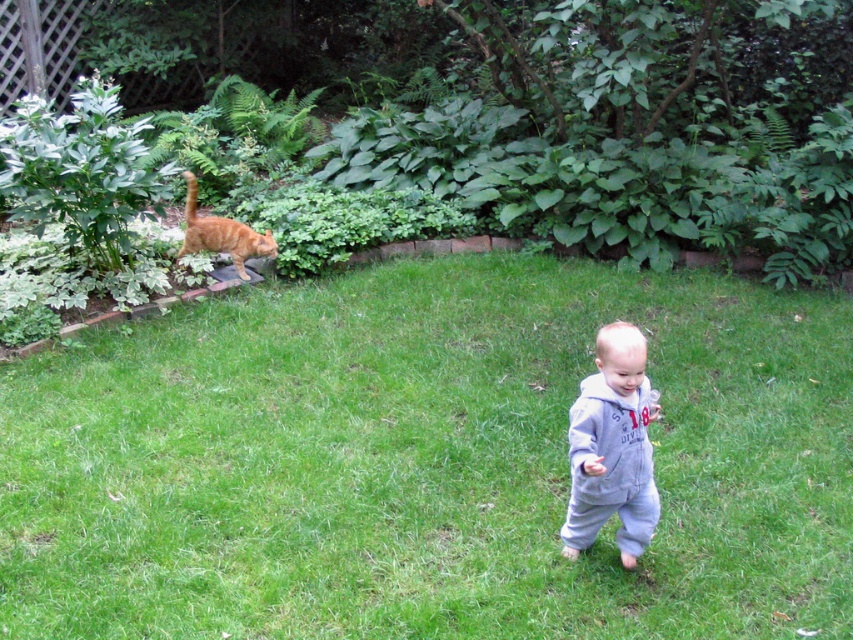
Question: Which point appears closest to the camera in this image?

Choices:
 (A) (621, 480)
 (B) (207, 236)

Answer: (A)

Question: Can you confirm if green grass at upper left is positioned to the right of orange fur cat at upper left?

Choices:
 (A) yes
 (B) no

Answer: (A)

Question: Among these objects, which one is nearest to the camera?

Choices:
 (A) gray fleece onesie at center
 (B) orange fur cat at upper left
 (C) green grass at upper left

Answer: (A)

Question: Can you confirm if green grass at upper left is positioned above gray fleece onesie at center?

Choices:
 (A) no
 (B) yes

Answer: (B)

Question: Which object is closer to the camera taking this photo?

Choices:
 (A) orange fur cat at upper left
 (B) green grass at upper left

Answer: (B)

Question: Does green grass at upper left have a smaller size compared to orange fur cat at upper left?

Choices:
 (A) yes
 (B) no

Answer: (B)